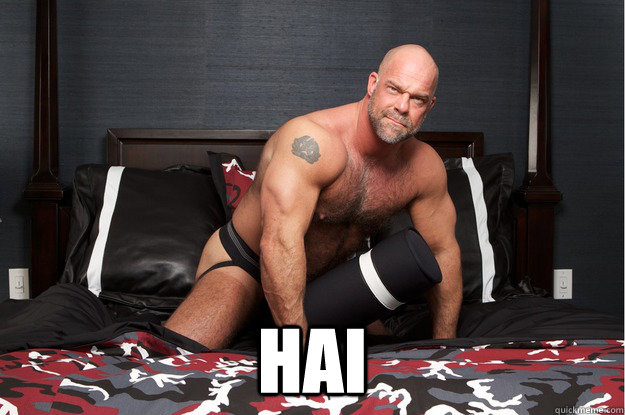
In order to click on blankets in this screenshot , I will do `click(109, 381)`, `click(462, 377)`, `click(560, 379)`.